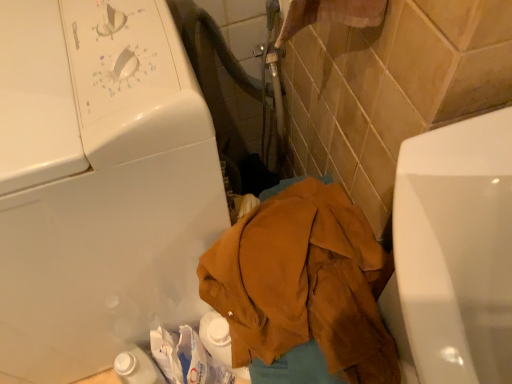
Question: Choose the correct answer: Is white glossy washing machine at upper left inside brown corduroy jacket at center or outside it?

Choices:
 (A) outside
 (B) inside

Answer: (A)

Question: Is white glossy washing machine at upper left taller or shorter than brown corduroy jacket at center?

Choices:
 (A) tall
 (B) short

Answer: (A)

Question: From a real-world perspective, is white glossy washing machine at upper left above or below brown corduroy jacket at center?

Choices:
 (A) above
 (B) below

Answer: (A)

Question: Is brown corduroy jacket at center in front of or behind white glossy washing machine at upper left in the image?

Choices:
 (A) behind
 (B) front

Answer: (A)

Question: From the image's perspective, relative to white glossy washing machine at upper left, is brown corduroy jacket at center above or below?

Choices:
 (A) above
 (B) below

Answer: (B)

Question: Based on their sizes in the image, would you say brown corduroy jacket at center is bigger or smaller than white glossy washing machine at upper left?

Choices:
 (A) small
 (B) big

Answer: (A)

Question: In terms of height, does brown corduroy jacket at center look taller or shorter compared to white glossy washing machine at upper left?

Choices:
 (A) tall
 (B) short

Answer: (B)